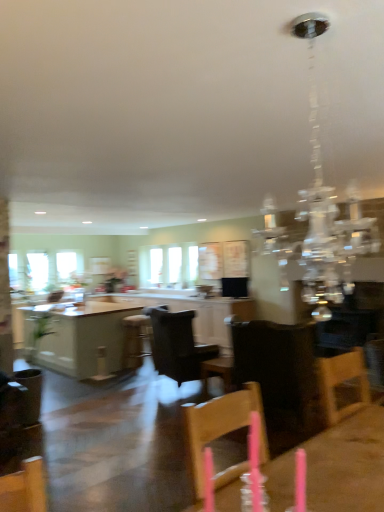
Question: Can you confirm if white glossy table at center, placed as the second table when sorted from top to bottom, is positioned to the right of black leather chair at center, the first chair in the left-to-right sequence?

Choices:
 (A) yes
 (B) no

Answer: (B)

Question: Could black leather chair at center, the 2th chair positioned from the right, be considered to be inside white glossy table at center, marked as the 1th table in a left-to-right arrangement?

Choices:
 (A) yes
 (B) no

Answer: (B)

Question: Can you confirm if white glossy table at center, which appears as the first table when ordered from the bottom, is wider than black leather chair at center, positioned as the 1th chair in back-to-front order?

Choices:
 (A) yes
 (B) no

Answer: (A)

Question: Can you confirm if white glossy table at center, which appears as the first table when ordered from the bottom, is positioned to the left of black leather chair at center, the 2th chair positioned from the front?

Choices:
 (A) yes
 (B) no

Answer: (A)

Question: From the image's perspective, is white glossy table at center, arranged as the second table when viewed from the right, located beneath black leather chair at center, the 2th chair positioned from the right?

Choices:
 (A) yes
 (B) no

Answer: (A)

Question: Could you tell me if white glossy table at center, marked as the second table in a front-to-back arrangement, is facing black leather chair at center, the 2th chair positioned from the front?

Choices:
 (A) yes
 (B) no

Answer: (B)

Question: Is clear glass window at center, the first window from the right, smaller than clear glass window at left, marked as the second window in a right-to-left arrangement?

Choices:
 (A) yes
 (B) no

Answer: (B)

Question: Does clear glass window at center, the first window from the right, lie behind clear glass window at left, marked as the second window in a right-to-left arrangement?

Choices:
 (A) no
 (B) yes

Answer: (A)

Question: Is clear glass window at center, the first window from the right, far away from clear glass window at left, marked as the second window in a right-to-left arrangement?

Choices:
 (A) yes
 (B) no

Answer: (A)

Question: Is clear glass window at center, which appears as the second window when viewed from the left, touching clear glass window at left, marked as the second window in a right-to-left arrangement?

Choices:
 (A) no
 (B) yes

Answer: (A)

Question: From the image's perspective, is clear glass window at center, the first window from the right, over clear glass window at left, positioned as the 1th window in left-to-right order?

Choices:
 (A) yes
 (B) no

Answer: (A)

Question: Is clear glass window at center, the first window from the right, bigger than clear glass window at left, positioned as the 1th window in left-to-right order?

Choices:
 (A) yes
 (B) no

Answer: (A)

Question: Is black leather chair at center, the 2th chair positioned from the front, aimed at white glossy table at center, marked as the 1th table in a left-to-right arrangement?

Choices:
 (A) no
 (B) yes

Answer: (A)